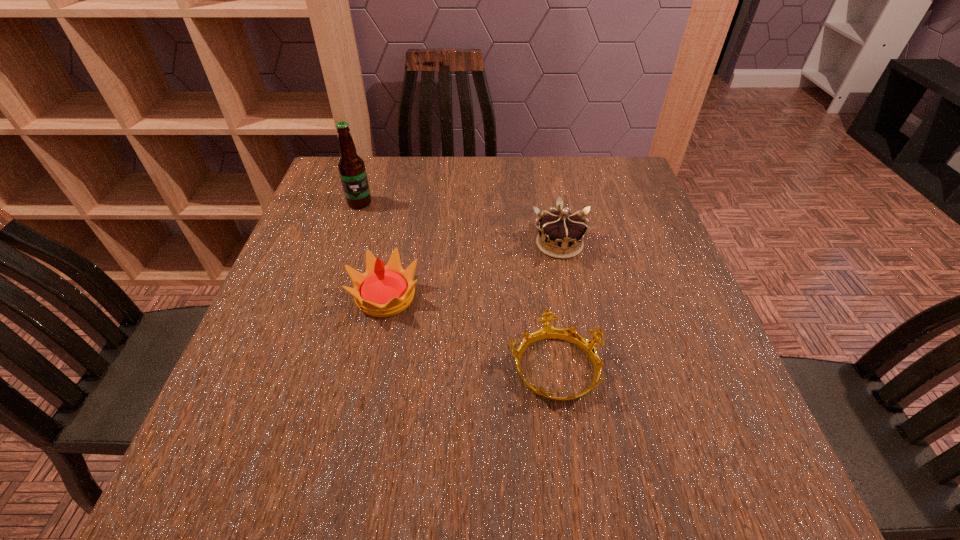
Find the location of a particular element. This screenshot has width=960, height=540. the leftmost object is located at coordinates (351, 167).

Locate an element on the screen. the farthest object is located at coordinates (351, 167).

I want to click on the second nearest object, so click(x=382, y=291).

At what (x,y) coordinates should I click in order to perform the action: click on the second nearest crown. Please return your answer as a coordinate pair (x, y). The width and height of the screenshot is (960, 540). Looking at the image, I should click on (382, 291).

Where is `the farthest crown`? The height and width of the screenshot is (540, 960). the farthest crown is located at coordinates (561, 234).

Where is `the nearest crown`? The width and height of the screenshot is (960, 540). the nearest crown is located at coordinates (547, 332).

Find the location of a particular element. The image size is (960, 540). the nearest object is located at coordinates (547, 332).

Find the location of `vacant region located on the label of the beer bottle`. vacant region located on the label of the beer bottle is located at coordinates (351, 227).

I want to click on free location located on the right of the second object from left to right, so click(601, 296).

I want to click on free space located 0.120m on the back of the farthest crown, so click(x=550, y=196).